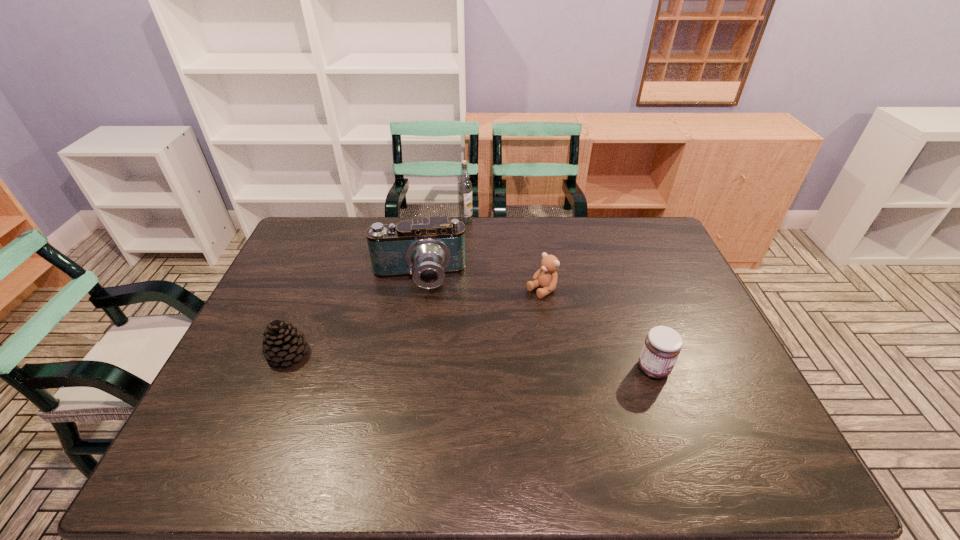
Where is `vacant space on the desktop that is between the leftmost object and the rightmost object and is positioned on the front-facing side of the teddy bear`? vacant space on the desktop that is between the leftmost object and the rightmost object and is positioned on the front-facing side of the teddy bear is located at coordinates (430, 359).

You are a GUI agent. You are given a task and a screenshot of the screen. Output one action in this format:
    pyautogui.click(x=<x>, y=<y>)
    Task: Click on the vacant space on the desktop that is between the pinecone and the jam and is positioned on the label of the farthest object
    
    Given the screenshot: What is the action you would take?
    pyautogui.click(x=498, y=362)

Identify the location of free space on the desktop that is between the leftmost object and the rightmost object and is positioned on the front-facing side of the fourth shortest object. (419, 359).